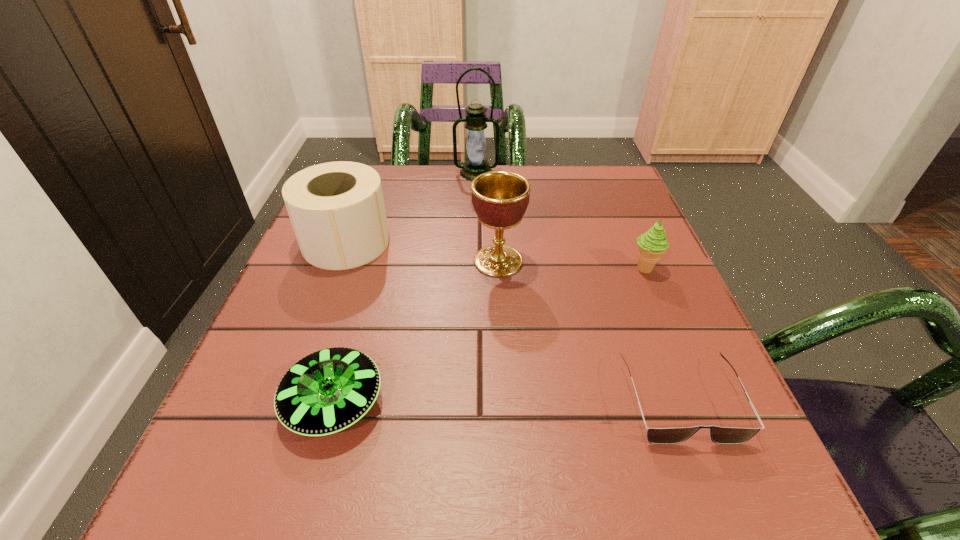
Locate an element on the screen. Image resolution: width=960 pixels, height=540 pixels. vacant region between the second shortest object and the shortest object is located at coordinates (507, 402).

I want to click on vacant region between the fourth tallest object and the lantern, so [561, 220].

The width and height of the screenshot is (960, 540). What are the coordinates of `unoccupied position between the saucer and the chalice` in the screenshot? It's located at (417, 332).

I want to click on vacant area that lies between the toilet tissue and the fifth shortest object, so click(x=422, y=252).

In order to click on vacant region between the chalice and the third shortest object in this screenshot , I will do `click(571, 265)`.

Where is `the fifth closest object relative to the fifth shortest object`? The height and width of the screenshot is (540, 960). the fifth closest object relative to the fifth shortest object is located at coordinates (475, 164).

Identify which object is the nearest to the farthest object. Please provide its 2D coordinates. Your answer should be formatted as a tuple, i.e. [(x, y)], where the tuple contains the x and y coordinates of a point satisfying the conditions above.

[(337, 211)]

The height and width of the screenshot is (540, 960). In order to click on vacant space that satisfies the following two spatial constraints: 1. on the back side of the second shortest object; 2. on the left side of the fourth tallest object in this screenshot , I will do `click(372, 268)`.

Locate an element on the screen. The height and width of the screenshot is (540, 960). vacant space that satisfies the following two spatial constraints: 1. on the side where the icecream emits light; 2. on the left side of the tallest object is located at coordinates (475, 268).